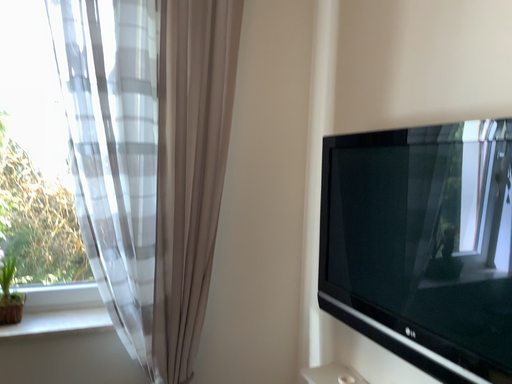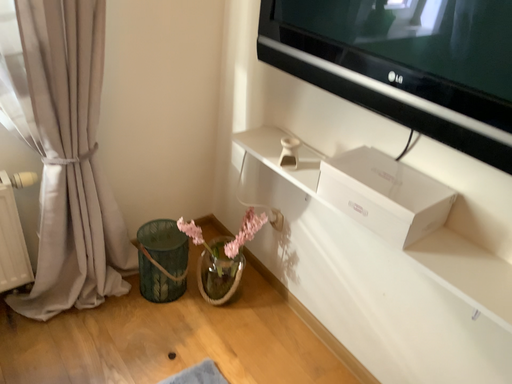
Question: Which way did the camera rotate in the video?

Choices:
 (A) rotated downward
 (B) rotated upward

Answer: (A)